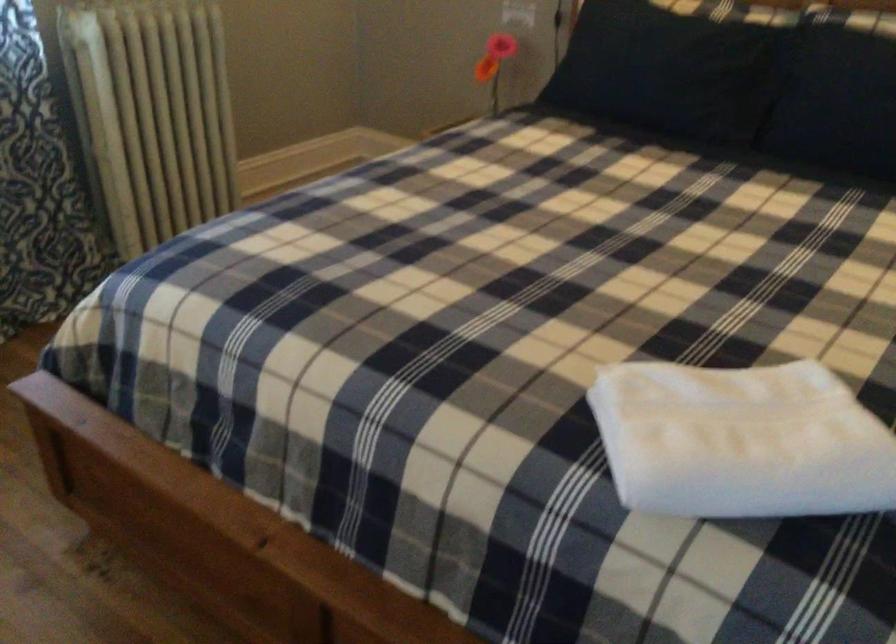
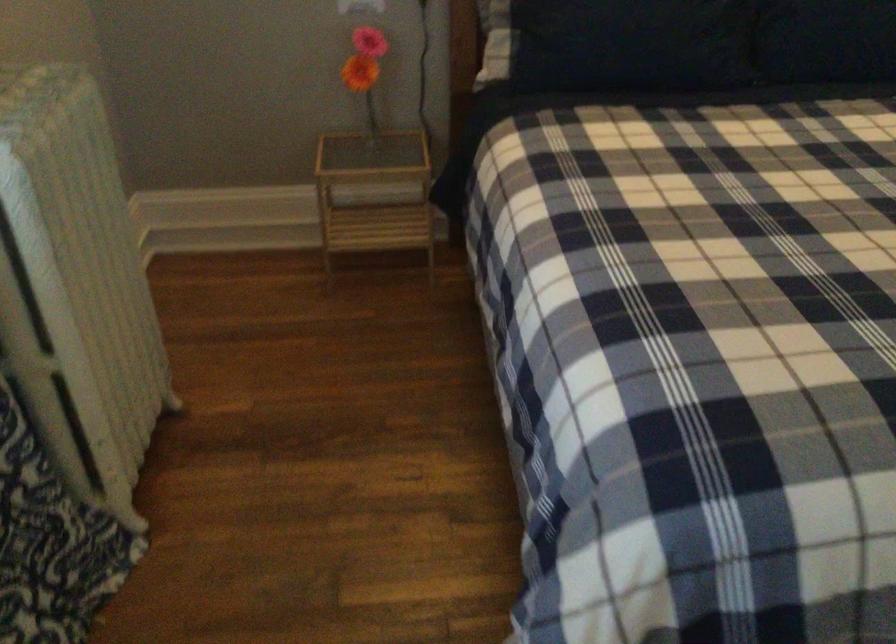
Find the pixel in the second image that matches point (822, 129) in the first image.

(830, 43)